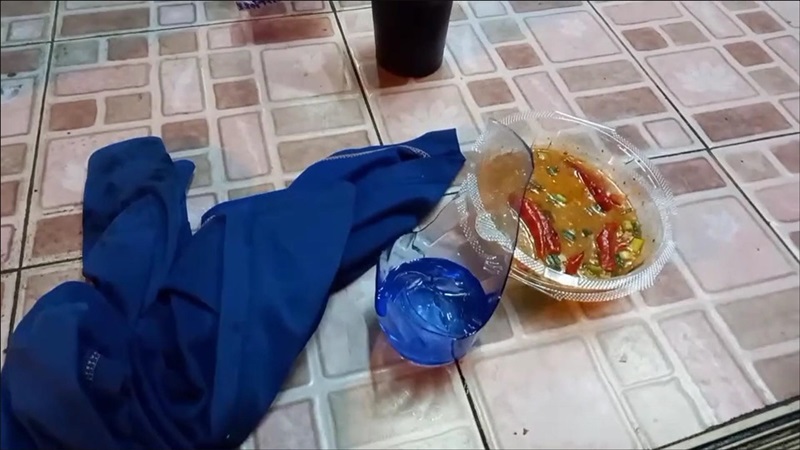
In order to click on empty space on table in this screenshot , I will do `click(134, 82)`.